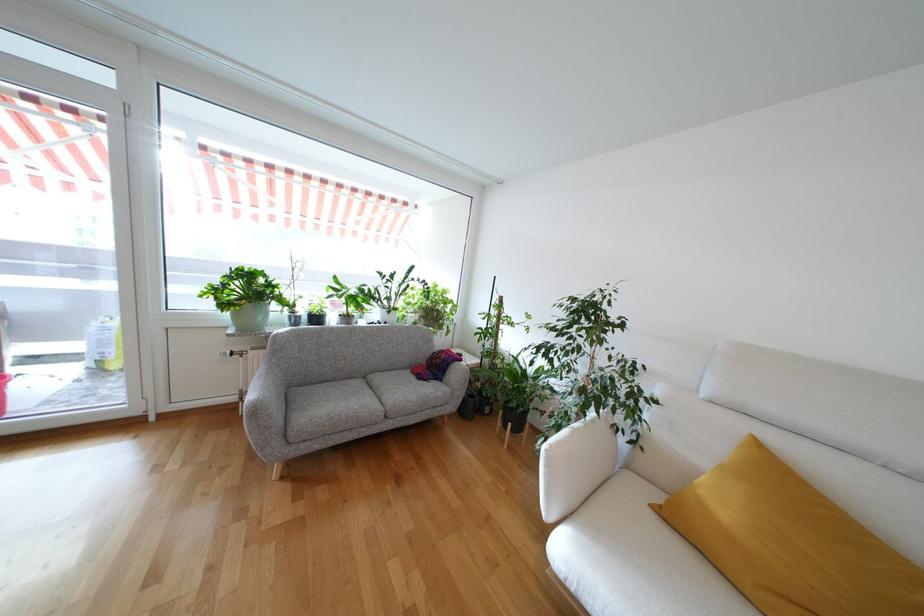
The height and width of the screenshot is (616, 924). Describe the element at coordinates (648, 564) in the screenshot. I see `the white sofa sitting surface` at that location.